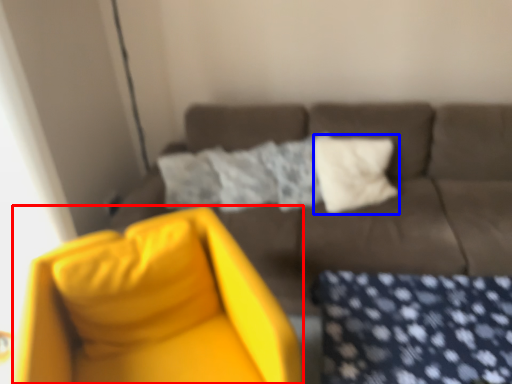
Question: Which object appears farthest to the camera in this image, swivel chair (highlighted by a red box) or pillow (highlighted by a blue box)?

Choices:
 (A) swivel chair
 (B) pillow

Answer: (B)